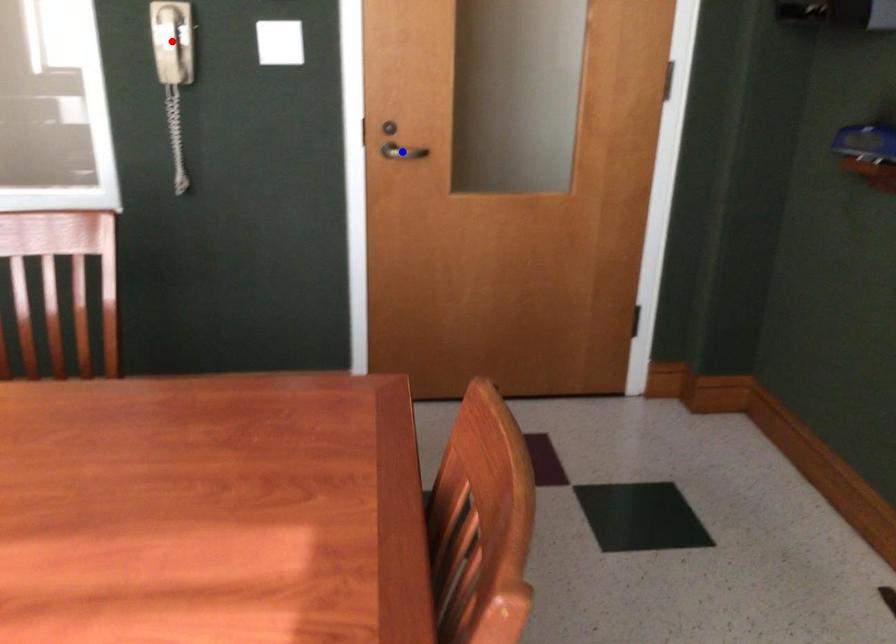
Question: Two points are marked on the image. Which point is closer to the camera?

Choices:
 (A) Blue point is closer.
 (B) Red point is closer.

Answer: (B)